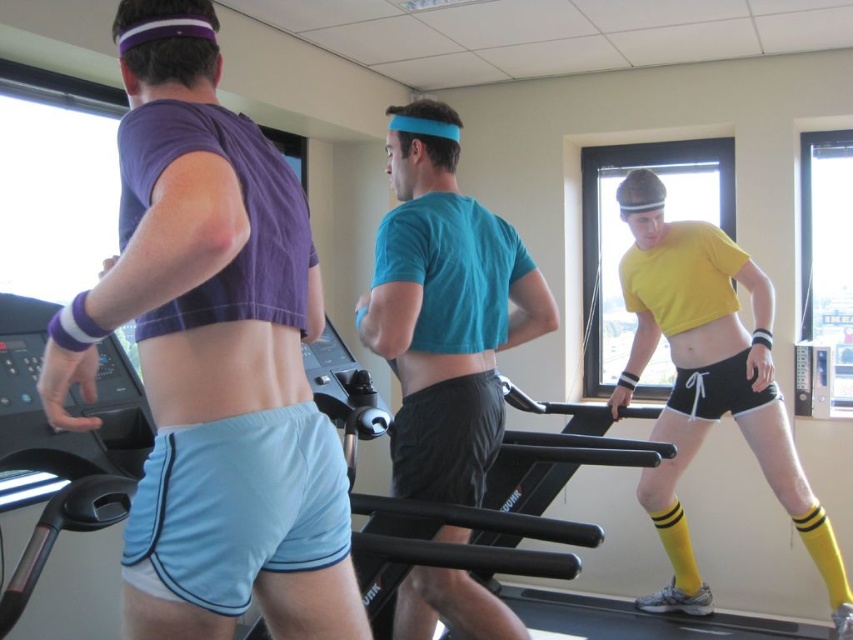
Question: Which of the following is the farthest from the observer?

Choices:
 (A) yellow matte shorts at center
 (B) teal matte t-shirt at center
 (C) matte purple t-shirt at left

Answer: (A)

Question: Does teal matte t-shirt at center appear over yellow matte shorts at center?

Choices:
 (A) yes
 (B) no

Answer: (A)

Question: Is matte purple t-shirt at left closer to camera compared to teal matte t-shirt at center?

Choices:
 (A) yes
 (B) no

Answer: (A)

Question: Which point appears closest to the camera in this image?

Choices:
 (A) (399, 275)
 (B) (140, 628)
 (C) (689, 269)

Answer: (B)

Question: Which point is closer to the camera?

Choices:
 (A) (456, 115)
 (B) (746, 365)
 (C) (287, 413)

Answer: (C)

Question: Can you confirm if matte purple t-shirt at left is positioned to the left of teal matte t-shirt at center?

Choices:
 (A) yes
 (B) no

Answer: (A)